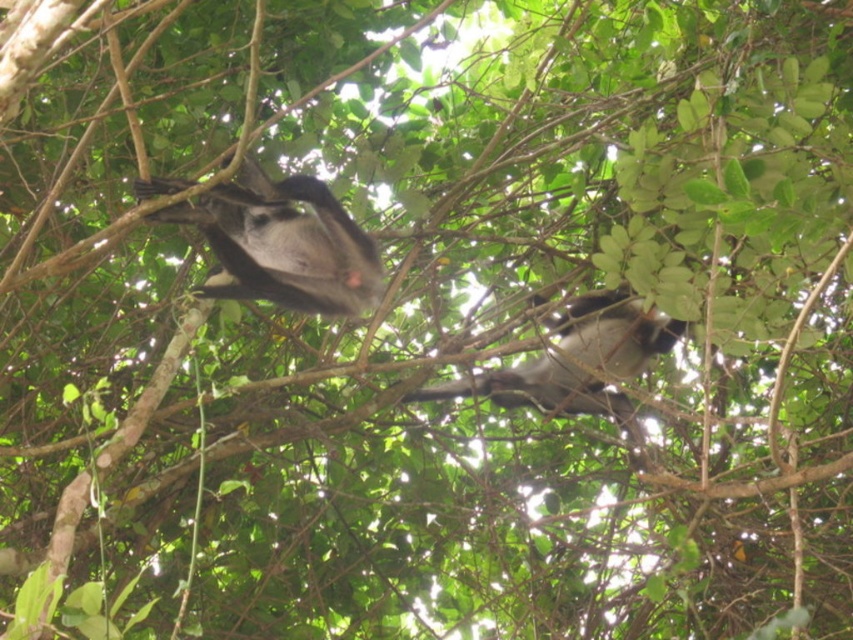
Question: Is gray furry monkey at upper center behind gray furry monkey at center?

Choices:
 (A) yes
 (B) no

Answer: (B)

Question: Does gray furry monkey at upper center have a greater width compared to gray furry monkey at center?

Choices:
 (A) no
 (B) yes

Answer: (A)

Question: Does gray furry monkey at upper center have a smaller size compared to gray furry monkey at center?

Choices:
 (A) yes
 (B) no

Answer: (A)

Question: Which point is closer to the camera?

Choices:
 (A) gray furry monkey at upper center
 (B) gray furry monkey at center

Answer: (A)

Question: Which object appears farthest from the camera in this image?

Choices:
 (A) gray furry monkey at center
 (B) gray furry monkey at upper center

Answer: (A)